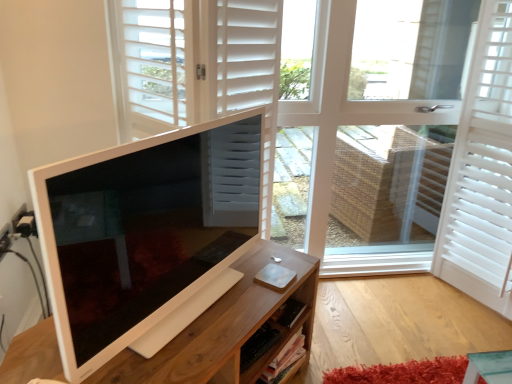
Question: From a real-world perspective, is white matte door at center under wooden desk at center?

Choices:
 (A) yes
 (B) no

Answer: (B)

Question: Is wooden desk at center surrounded by white matte door at center?

Choices:
 (A) yes
 (B) no

Answer: (B)

Question: Are white matte door at center and wooden desk at center beside each other?

Choices:
 (A) no
 (B) yes

Answer: (A)

Question: From a real-world perspective, is white matte door at center positioned over wooden desk at center based on gravity?

Choices:
 (A) no
 (B) yes

Answer: (B)

Question: Does white matte door at center have a lesser width compared to wooden desk at center?

Choices:
 (A) no
 (B) yes

Answer: (A)

Question: Is white matte shutter at right spatially inside wooden desk at center, or outside of it?

Choices:
 (A) inside
 (B) outside

Answer: (B)

Question: Is white matte shutter at right taller or shorter than wooden desk at center?

Choices:
 (A) tall
 (B) short

Answer: (A)

Question: From a real-world perspective, is white matte shutter at right above or below wooden desk at center?

Choices:
 (A) above
 (B) below

Answer: (A)

Question: Is white matte shutter at right wider or thinner than wooden desk at center?

Choices:
 (A) wide
 (B) thin

Answer: (B)

Question: Is point (227, 165) positioned closer to the camera than point (242, 72)?

Choices:
 (A) farther
 (B) closer

Answer: (B)

Question: From the image's perspective, is white glossy computer monitor at left above or below white matte door at center?

Choices:
 (A) above
 (B) below

Answer: (B)

Question: Would you say white glossy computer monitor at left is inside or outside white matte door at center?

Choices:
 (A) outside
 (B) inside

Answer: (A)

Question: In terms of size, does white glossy computer monitor at left appear bigger or smaller than white matte door at center?

Choices:
 (A) big
 (B) small

Answer: (B)

Question: Is point tap(273, 120) positioned closer to the camera than point tap(204, 350)?

Choices:
 (A) closer
 (B) farther

Answer: (B)

Question: From the image's perspective, is white matte door at center positioned above or below wooden desk at center?

Choices:
 (A) below
 (B) above

Answer: (B)